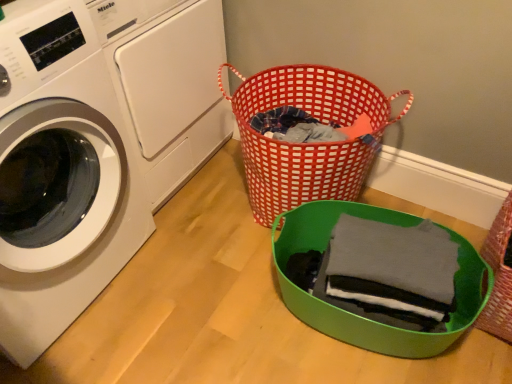
Where is `vacant area situated to the left side of red woven basket at center, placed as the 3th basket when sorted from right to left`? vacant area situated to the left side of red woven basket at center, placed as the 3th basket when sorted from right to left is located at coordinates (203, 213).